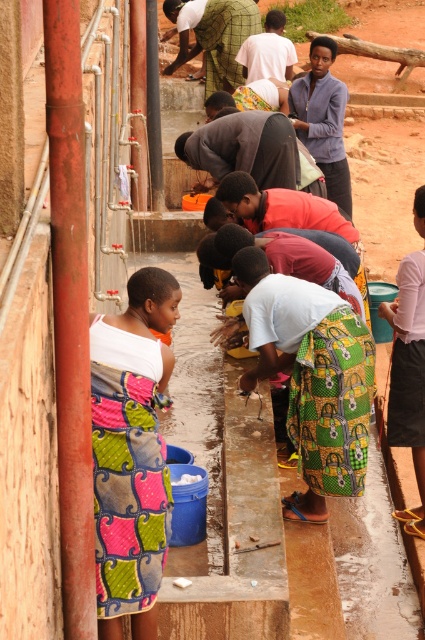
Question: Based on their relative distances, which object is farther from the multicolored fabric skirt at lower left?

Choices:
 (A) green woven cloth at center
 (B) pink fabric skirt at lower right

Answer: (A)

Question: Which of the following is the closest to the observer?

Choices:
 (A) green woven cloth at center
 (B) multicolored fabric skirt at lower left
 (C) pink fabric skirt at lower right

Answer: (B)

Question: Does multicolored fabric skirt at lower left have a larger size compared to green woven cloth at center?

Choices:
 (A) yes
 (B) no

Answer: (B)

Question: Can you confirm if multicolored fabric skirt at lower left is positioned to the left of pink fabric skirt at lower right?

Choices:
 (A) yes
 (B) no

Answer: (A)

Question: Which point is closer to the camera?

Choices:
 (A) green woven cloth at center
 (B) pink fabric skirt at lower right

Answer: (B)

Question: Is multicolored fabric skirt at lower left bigger than green woven cloth at center?

Choices:
 (A) yes
 (B) no

Answer: (B)